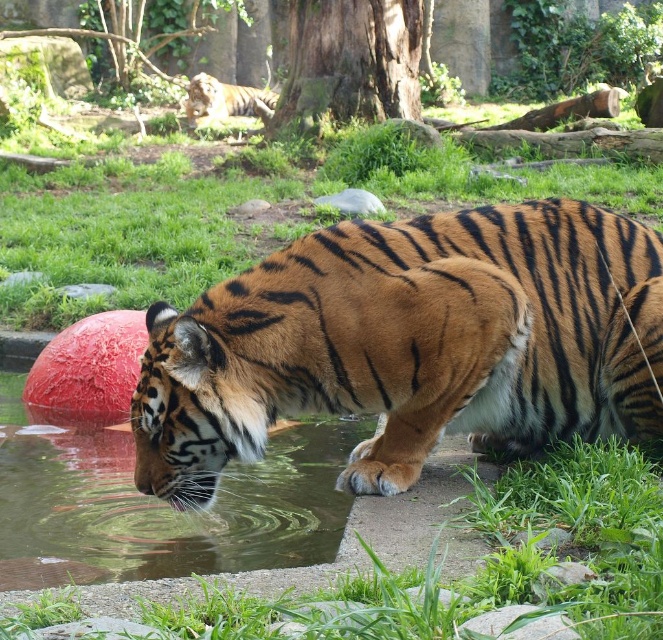
Question: Is orange fur tiger at center thinner than clear water at lower left?

Choices:
 (A) no
 (B) yes

Answer: (B)

Question: Which object appears closest to the camera in this image?

Choices:
 (A) orange fur tiger at center
 (B) orange striped tiger at upper center

Answer: (A)

Question: Which object is positioned closest to the clear water at lower left?

Choices:
 (A) orange striped tiger at upper center
 (B) orange fur tiger at center

Answer: (B)

Question: Does orange fur tiger at center come behind orange striped tiger at upper center?

Choices:
 (A) yes
 (B) no

Answer: (B)

Question: Which point appears farthest from the camera in this image?

Choices:
 (A) (x=324, y=429)
 (B) (x=524, y=316)

Answer: (A)

Question: Is orange fur tiger at center closer to camera compared to clear water at lower left?

Choices:
 (A) yes
 (B) no

Answer: (A)